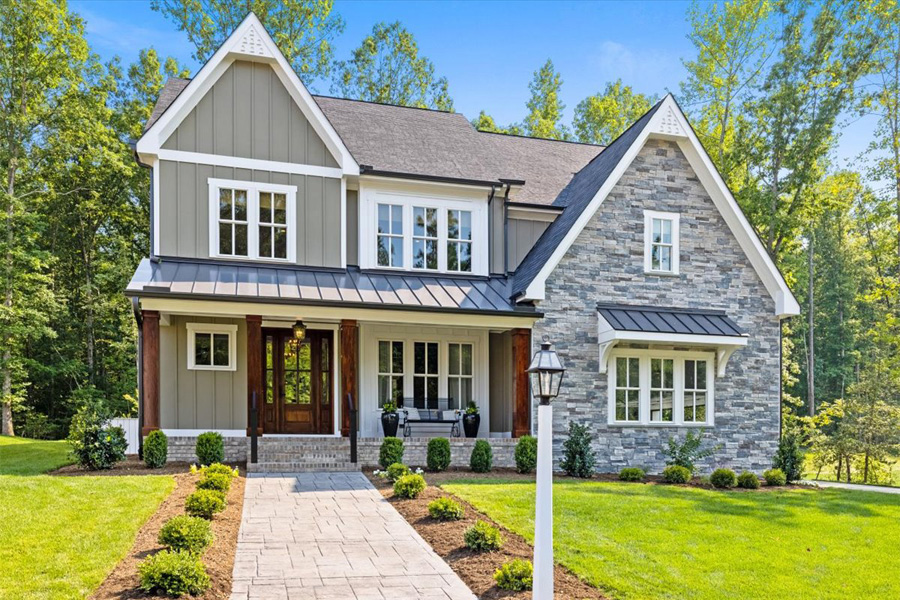
Identify the location of planters and pillows. This screenshot has height=600, width=900. (469, 424), (390, 424), (450, 413), (418, 414).